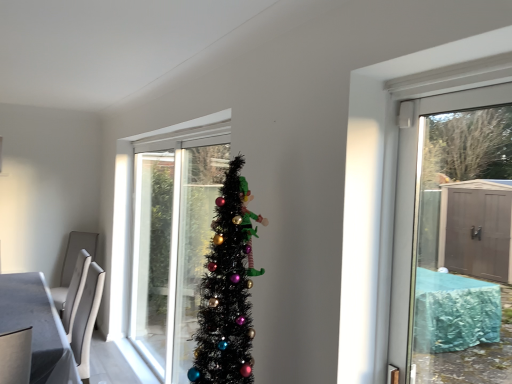
Image resolution: width=512 pixels, height=384 pixels. Describe the element at coordinates (37, 327) in the screenshot. I see `white glossy table at lower left` at that location.

Where is `white glossy table at lower left`? white glossy table at lower left is located at coordinates (37, 327).

Find the location of `transparent glass door at upper right`. transparent glass door at upper right is located at coordinates [453, 238].

Image resolution: width=512 pixels, height=384 pixels. Describe the element at coordinates (453, 238) in the screenshot. I see `transparent glass door at upper right` at that location.

You are a GUI agent. You are given a task and a screenshot of the screen. Output one action in this format:
    pyautogui.click(x=<x>, y=<y>)
    Task: Click on the white glossy table at lower left
    The height and width of the screenshot is (384, 512).
    Given the screenshot: What is the action you would take?
    pyautogui.click(x=37, y=327)

Which is more to the right, transparent glass door at upper right or white glossy table at lower left?

transparent glass door at upper right is more to the right.

Does transparent glass door at upper right lie behind white glossy table at lower left?

No, transparent glass door at upper right is in front of white glossy table at lower left.

Does point (510, 167) appear closer or farther from the camera than point (5, 305)?

Point (510, 167) is positioned closer to the camera compared to point (5, 305).

Based on the photo, from the image's perspective, which is above, transparent glass door at upper right or white glossy table at lower left?

From the image's view, transparent glass door at upper right is above.

From a real-world perspective, between transparent glass door at upper right and white glossy table at lower left, who is vertically higher?

In real-world perspective, transparent glass door at upper right is above.

Looking at their sizes, would you say transparent glass door at upper right is wider or thinner than white glossy table at lower left?

In the image, transparent glass door at upper right appears to be more narrow than white glossy table at lower left.

Does transparent glass door at upper right have a lesser height compared to white glossy table at lower left?

No.

Based on their sizes in the image, would you say transparent glass door at upper right is bigger or smaller than white glossy table at lower left?

In the image, transparent glass door at upper right appears to be smaller than white glossy table at lower left.

Would you say transparent glass door at upper right is inside or outside white glossy table at lower left?

transparent glass door at upper right is outside white glossy table at lower left.

Is transparent glass door at upper right far from white glossy table at lower left?

transparent glass door at upper right is far away from white glossy table at lower left.

Is transparent glass door at upper right turned away from white glossy table at lower left?

transparent glass door at upper right does not have its back to white glossy table at lower left.

How many degrees apart are the facing directions of transparent glass door at upper right and white glossy table at lower left?

They differ by 0.241 degrees in their facing directions.

How far apart are transparent glass door at upper right and white glossy table at lower left?

They are 3.52 meters apart.

Where is `door that appears in front of the white glossy table at lower left`? The image size is (512, 384). door that appears in front of the white glossy table at lower left is located at coordinates (453, 238).

Can you confirm if white glossy table at lower left is positioned to the left of transparent glass door at upper right?

Correct, you'll find white glossy table at lower left to the left of transparent glass door at upper right.

Considering the positions of objects white glossy table at lower left and transparent glass door at upper right in the image provided, who is behind, white glossy table at lower left or transparent glass door at upper right?

white glossy table at lower left is behind.

Which is closer, [21,319] or [414,339]?

Point [21,319].

From the image's perspective, is white glossy table at lower left over transparent glass door at upper right?

Actually, white glossy table at lower left appears below transparent glass door at upper right in the image.

From a real-world perspective, is white glossy table at lower left below transparent glass door at upper right?

Indeed, from a real-world perspective, white glossy table at lower left is positioned beneath transparent glass door at upper right.

Considering the sizes of objects white glossy table at lower left and transparent glass door at upper right in the image provided, who is thinner, white glossy table at lower left or transparent glass door at upper right?

Thinner between the two is transparent glass door at upper right.

Who is shorter, white glossy table at lower left or transparent glass door at upper right?

white glossy table at lower left.

Who is smaller, white glossy table at lower left or transparent glass door at upper right?

With smaller size is transparent glass door at upper right.

Is white glossy table at lower left situated inside transparent glass door at upper right or outside?

white glossy table at lower left is outside transparent glass door at upper right.

Would you say white glossy table at lower left is a long distance from transparent glass door at upper right?

white glossy table at lower left is positioned a significant distance from transparent glass door at upper right.

Is white glossy table at lower left looking in the opposite direction of transparent glass door at upper right?

No.

In the scene shown: How different are the orientations of white glossy table at lower left and transparent glass door at upper right in degrees?

0.241 degrees.

Locate an element on the screen. door in front of the white glossy table at lower left is located at coordinates (453, 238).

Identify the location of door that is above the white glossy table at lower left (from a real-world perspective). (453, 238).

This screenshot has height=384, width=512. I want to click on table below the transparent glass door at upper right (from the image's perspective), so click(37, 327).